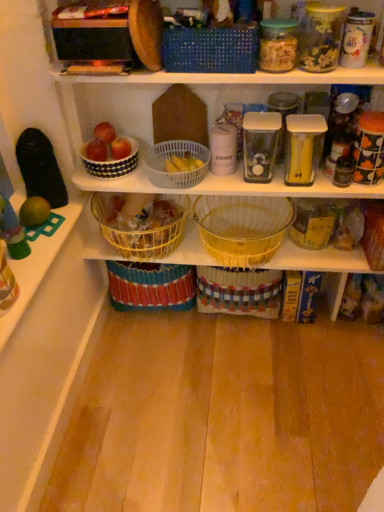
Question: In the image, is shiny red apple at upper center, positioned as the second apple in left-to-right order, positioned in front of or behind clear plastic container at center, the third glass jar positioned from the left?

Choices:
 (A) front
 (B) behind

Answer: (B)

Question: Considering the positions of shiny red apple at upper center, positioned as the second apple in left-to-right order, and clear plastic container at center, arranged as the third glass jar when viewed from the right, in the image, is shiny red apple at upper center, positioned as the second apple in left-to-right order, taller or shorter than clear plastic container at center, arranged as the third glass jar when viewed from the right,?

Choices:
 (A) short
 (B) tall

Answer: (A)

Question: Which is nearer to the yellow woven basket at center, which appears as the 1th basket when viewed from the left?

Choices:
 (A) transparent plastic container at center, the 5th glass jar from the right
 (B) translucent plastic jar at upper center, the 2th glass jar in the left-to-right sequence
 (C) black glass jar at right
 (D) red matte apple at upper left, marked as the 2th apple in a right-to-left arrangement
 (E) yellow wicker basket at center

Answer: (E)

Question: Considering the real-world distances, which object is farthest from the white glossy canister at upper right, which appears as the 5th glass jar when viewed from the left?

Choices:
 (A) black glass jar at right
 (B) white plastic basket at center, positioned as the fourth basket in right-to-left order
 (C) yellow wicker basket at center
 (D) yellow woven basket at center, which appears as the 1th basket when viewed from the left
 (E) translucent plastic jar at upper center, positioned as the 4th glass jar in right-to-left order

Answer: (D)